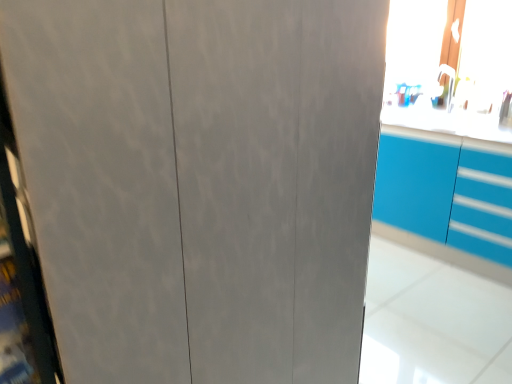
Question: From a real-world perspective, is transparent plastic window screen at upper right physically below blue glossy cabinet at upper right?

Choices:
 (A) no
 (B) yes

Answer: (A)

Question: Is the surface of transparent plastic window screen at upper right in direct contact with blue glossy cabinet at upper right?

Choices:
 (A) yes
 (B) no

Answer: (B)

Question: From a real-world perspective, is transparent plastic window screen at upper right on blue glossy cabinet at upper right?

Choices:
 (A) yes
 (B) no

Answer: (A)

Question: Does transparent plastic window screen at upper right come behind blue glossy cabinet at upper right?

Choices:
 (A) no
 (B) yes

Answer: (B)

Question: Is transparent plastic window screen at upper right located outside blue glossy cabinet at upper right?

Choices:
 (A) yes
 (B) no

Answer: (A)

Question: Considering the relative sizes of transparent plastic window screen at upper right and blue glossy cabinet at upper right in the image provided, is transparent plastic window screen at upper right thinner than blue glossy cabinet at upper right?

Choices:
 (A) yes
 (B) no

Answer: (A)

Question: Would you say blue glossy cabinet at upper right is a long distance from transparent plastic window screen at upper right?

Choices:
 (A) yes
 (B) no

Answer: (B)

Question: Is blue glossy cabinet at upper right looking in the opposite direction of transparent plastic window screen at upper right?

Choices:
 (A) yes
 (B) no

Answer: (B)

Question: From a real-world perspective, is blue glossy cabinet at upper right on transparent plastic window screen at upper right?

Choices:
 (A) yes
 (B) no

Answer: (B)

Question: Is blue glossy cabinet at upper right to the right of transparent plastic window screen at upper right from the viewer's perspective?

Choices:
 (A) yes
 (B) no

Answer: (B)

Question: From the image's perspective, is blue glossy cabinet at upper right located beneath transparent plastic window screen at upper right?

Choices:
 (A) no
 (B) yes

Answer: (B)

Question: Is blue glossy cabinet at upper right taller than transparent plastic window screen at upper right?

Choices:
 (A) yes
 (B) no

Answer: (A)

Question: From a real-world perspective, is blue glossy cabinet at upper right positioned above or below transparent plastic window screen at upper right?

Choices:
 (A) above
 (B) below

Answer: (B)